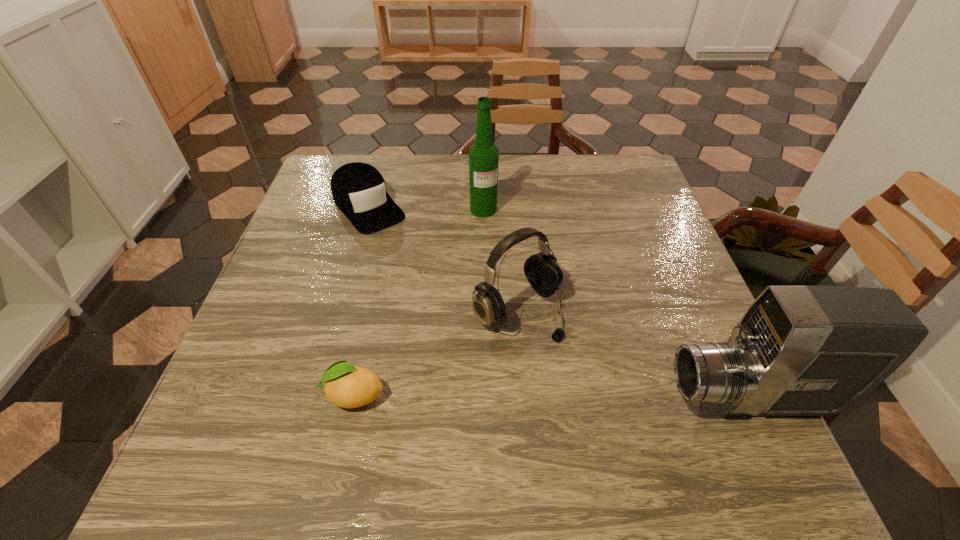
What are the coordinates of `unoccupied area between the shortest object and the third farthest object` in the screenshot? It's located at (436, 353).

Find the location of a particular element. The height and width of the screenshot is (540, 960). free space between the cap and the shortest object is located at coordinates (361, 301).

What are the coordinates of `free space between the shortest object and the beer bottle` in the screenshot? It's located at (419, 302).

Identify the location of vacant area that lies between the shortest object and the third farthest object. (436, 353).

Locate an element on the screen. free spot between the rightmost object and the third nearest object is located at coordinates (633, 355).

This screenshot has height=540, width=960. In order to click on the closest object to the rightmost object in this screenshot , I will do `click(542, 270)`.

Select which object appears as the second closest to the cap. Please provide its 2D coordinates. Your answer should be formatted as a tuple, i.e. [(x, y)], where the tuple contains the x and y coordinates of a point satisfying the conditions above.

[(542, 270)]

The image size is (960, 540). I want to click on free space that satisfies the following two spatial constraints: 1. on the front side of the third tallest object; 2. at the front of the rightmost object, highlighting the lens, so click(524, 399).

Where is `vacant space that satisfies the following two spatial constraints: 1. on the front side of the rightmost object; 2. at the front of the cap, highlighting the lens`? This screenshot has height=540, width=960. vacant space that satisfies the following two spatial constraints: 1. on the front side of the rightmost object; 2. at the front of the cap, highlighting the lens is located at coordinates (313, 399).